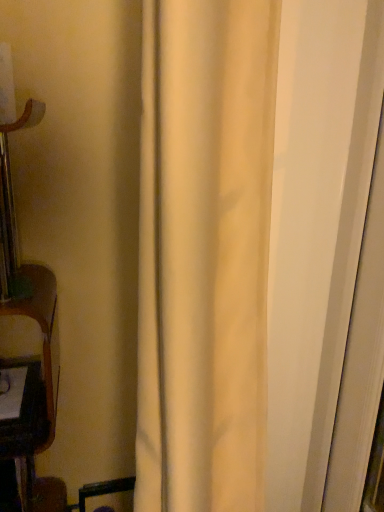
The image size is (384, 512). What do you see at coordinates (317, 228) in the screenshot?
I see `white glossy door at right` at bounding box center [317, 228].

The image size is (384, 512). I want to click on white glossy door at right, so click(x=317, y=228).

Where is `beige fabric curtain at center`? The image size is (384, 512). beige fabric curtain at center is located at coordinates (204, 252).

What is the approximate height of beige fabric curtain at center?

The height of beige fabric curtain at center is 3.72 feet.

Measure the distance between beige fabric curtain at center and camera.

The distance of beige fabric curtain at center from camera is 17.61 inches.

The width and height of the screenshot is (384, 512). Describe the element at coordinates (204, 252) in the screenshot. I see `beige fabric curtain at center` at that location.

The width and height of the screenshot is (384, 512). I want to click on white glossy door at right, so click(317, 228).

Considering the relative positions of white glossy door at right and beige fabric curtain at center in the image provided, is white glossy door at right to the right of beige fabric curtain at center from the viewer's perspective?

Indeed, white glossy door at right is positioned on the right side of beige fabric curtain at center.

Considering the relative positions of white glossy door at right and beige fabric curtain at center in the image provided, is white glossy door at right behind beige fabric curtain at center?

Yes, it is behind beige fabric curtain at center.

Does point (333, 233) come behind point (182, 60)?

Yes, it is behind point (182, 60).

From the image's perspective, is white glossy door at right under beige fabric curtain at center?

Actually, white glossy door at right appears above beige fabric curtain at center in the image.

From a real-world perspective, which is physically below, white glossy door at right or beige fabric curtain at center?

beige fabric curtain at center, from a real-world perspective.

Which of these two, white glossy door at right or beige fabric curtain at center, is thinner?

Thinner between the two is white glossy door at right.

Is white glossy door at right taller than beige fabric curtain at center?

No.

Is white glossy door at right bigger than beige fabric curtain at center?

Actually, white glossy door at right might be smaller than beige fabric curtain at center.

Can beige fabric curtain at center be found inside white glossy door at right?

Actually, beige fabric curtain at center is outside white glossy door at right.

Is white glossy door at right placed right next to beige fabric curtain at center?

No, white glossy door at right is not with beige fabric curtain at center.

Is white glossy door at right aimed at beige fabric curtain at center?

Yes, white glossy door at right faces towards beige fabric curtain at center.

Find the location of `curtain on the left of white glossy door at right`. curtain on the left of white glossy door at right is located at coordinates coord(204,252).

Can you confirm if beige fabric curtain at center is positioned to the left of white glossy door at right?

Correct, you'll find beige fabric curtain at center to the left of white glossy door at right.

Considering the positions of objects beige fabric curtain at center and white glossy door at right in the image provided, who is behind, beige fabric curtain at center or white glossy door at right?

white glossy door at right is further from the camera.

Is point (166, 432) positioned behind point (354, 138)?

No.

From the image's perspective, is beige fabric curtain at center over white glossy door at right?

No, from the image's perspective, beige fabric curtain at center is not above white glossy door at right.

From a real-world perspective, is beige fabric curtain at center positioned above or below white glossy door at right?

From a real-world perspective, beige fabric curtain at center is physically below white glossy door at right.

Is beige fabric curtain at center thinner than white glossy door at right?

No.

Considering the relative sizes of beige fabric curtain at center and white glossy door at right in the image provided, is beige fabric curtain at center taller than white glossy door at right?

Indeed, beige fabric curtain at center has a greater height compared to white glossy door at right.

Considering the relative sizes of beige fabric curtain at center and white glossy door at right in the image provided, is beige fabric curtain at center bigger than white glossy door at right?

Correct, beige fabric curtain at center is larger in size than white glossy door at right.

Which is correct: beige fabric curtain at center is inside white glossy door at right, or outside of it?

beige fabric curtain at center is outside white glossy door at right.

Is beige fabric curtain at center beside white glossy door at right?

No.

Is beige fabric curtain at center aimed at white glossy door at right?

No.

Can you tell me how much beige fabric curtain at center and white glossy door at right differ in facing direction?

0.998 degrees.

This screenshot has height=512, width=384. What are the coordinates of `curtain lying below the white glossy door at right (from the image's perspective)` in the screenshot? It's located at (204, 252).

At what (x,y) coordinates should I click in order to perform the action: click on curtain beneath the white glossy door at right (from a real-world perspective). Please return your answer as a coordinate pair (x, y). The width and height of the screenshot is (384, 512). Looking at the image, I should click on (204, 252).

The image size is (384, 512). What are the coordinates of `screen door above the beige fabric curtain at center (from the image's perspective)` in the screenshot? It's located at (317, 228).